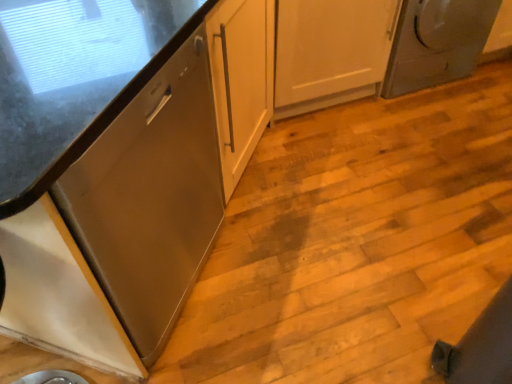
Describe the element at coordinates (74, 79) in the screenshot. The image size is (512, 384). I see `satin wood cabinet at left, positioned as the 2th cabinetry in bottom-to-top order` at that location.

What do you see at coordinates (437, 43) in the screenshot? Image resolution: width=512 pixels, height=384 pixels. I see `satin silver dryer at upper right` at bounding box center [437, 43].

What do you see at coordinates (59, 295) in the screenshot? I see `white glossy cabinet at lower left, the first cabinetry in the bottom-to-top sequence` at bounding box center [59, 295].

What are the coordinates of `white glossy cabinet at lower left, arranged as the second cabinetry when viewed from the top` in the screenshot? It's located at (59, 295).

The height and width of the screenshot is (384, 512). In order to click on satin wood cabinet at left, the 1th cabinetry positioned from the top in this screenshot , I will do `click(74, 79)`.

From the image's perspective, would you say satin silver dryer at upper right is shown under white glossy cabinet at lower left, the first cabinetry in the bottom-to-top sequence?

No, from the image's perspective, satin silver dryer at upper right is not beneath white glossy cabinet at lower left, the first cabinetry in the bottom-to-top sequence.

Is satin silver dryer at upper right aimed at white glossy cabinet at lower left, arranged as the second cabinetry when viewed from the top?

No, satin silver dryer at upper right is not facing towards white glossy cabinet at lower left, arranged as the second cabinetry when viewed from the top.

Is satin silver dryer at upper right smaller than white glossy cabinet at lower left, arranged as the second cabinetry when viewed from the top?

Actually, satin silver dryer at upper right might be larger than white glossy cabinet at lower left, arranged as the second cabinetry when viewed from the top.

From a real-world perspective, is satin wood cabinet at left, the 1th cabinetry positioned from the top, positioned above or below satin silver dryer at upper right?

satin wood cabinet at left, the 1th cabinetry positioned from the top, is above satin silver dryer at upper right.

Can you confirm if satin wood cabinet at left, positioned as the 2th cabinetry in bottom-to-top order, is positioned to the right of satin silver dryer at upper right?

No, satin wood cabinet at left, positioned as the 2th cabinetry in bottom-to-top order, is not to the right of satin silver dryer at upper right.

From the image's perspective, is satin wood cabinet at left, the 1th cabinetry positioned from the top, positioned above or below satin silver dryer at upper right?

satin wood cabinet at left, the 1th cabinetry positioned from the top, is situated lower than satin silver dryer at upper right in the image.

In order to click on home appliance above the satin wood cabinet at left, positioned as the 2th cabinetry in bottom-to-top order (from the image's perspective) in this screenshot , I will do `click(437, 43)`.

Image resolution: width=512 pixels, height=384 pixels. What are the coordinates of `home appliance on the right of satin wood cabinet at left, the 1th cabinetry positioned from the top` in the screenshot? It's located at (437, 43).

Is satin silver dryer at upper right outside of satin wood cabinet at left, the 1th cabinetry positioned from the top?

Yes, satin silver dryer at upper right is outside of satin wood cabinet at left, the 1th cabinetry positioned from the top.

Based on the photo, is satin silver dryer at upper right turned away from satin wood cabinet at left, positioned as the 2th cabinetry in bottom-to-top order?

satin silver dryer at upper right does not have its back to satin wood cabinet at left, positioned as the 2th cabinetry in bottom-to-top order.

Based on the photo, is satin silver dryer at upper right positioned behind satin wood cabinet at left, positioned as the 2th cabinetry in bottom-to-top order?

That is True.

In the scene shown: From a real-world perspective, is satin wood cabinet at left, positioned as the 2th cabinetry in bottom-to-top order, positioned under white glossy cabinet at lower left, arranged as the second cabinetry when viewed from the top, based on gravity?

Incorrect, from a real-world perspective, satin wood cabinet at left, positioned as the 2th cabinetry in bottom-to-top order, is higher than white glossy cabinet at lower left, arranged as the second cabinetry when viewed from the top.

This screenshot has height=384, width=512. Identify the location of cabinetry that is under the satin wood cabinet at left, positioned as the 2th cabinetry in bottom-to-top order (from a real-world perspective). (59, 295).

Would you say satin wood cabinet at left, positioned as the 2th cabinetry in bottom-to-top order, is inside or outside white glossy cabinet at lower left, the first cabinetry in the bottom-to-top sequence?

satin wood cabinet at left, positioned as the 2th cabinetry in bottom-to-top order, is spatially situated outside white glossy cabinet at lower left, the first cabinetry in the bottom-to-top sequence.

From the image's perspective, is satin wood cabinet at left, the 1th cabinetry positioned from the top, positioned above or below white glossy cabinet at lower left, the first cabinetry in the bottom-to-top sequence?

satin wood cabinet at left, the 1th cabinetry positioned from the top, is above white glossy cabinet at lower left, the first cabinetry in the bottom-to-top sequence.

Where is `the 2nd cabinetry in front of the satin silver dryer at upper right, counting from the anchor's position`? The width and height of the screenshot is (512, 384). the 2nd cabinetry in front of the satin silver dryer at upper right, counting from the anchor's position is located at coordinates (59, 295).

Which object is thinner, white glossy cabinet at lower left, the first cabinetry in the bottom-to-top sequence, or satin silver dryer at upper right?

white glossy cabinet at lower left, the first cabinetry in the bottom-to-top sequence.

From the image's perspective, which is below, white glossy cabinet at lower left, arranged as the second cabinetry when viewed from the top, or satin silver dryer at upper right?

white glossy cabinet at lower left, arranged as the second cabinetry when viewed from the top, appears lower in the image.

Between point (91, 277) and point (81, 35), which one is positioned behind?

The point (81, 35) is farther from the camera.

How different are the orientations of white glossy cabinet at lower left, the first cabinetry in the bottom-to-top sequence, and satin wood cabinet at left, positioned as the 2th cabinetry in bottom-to-top order, in degrees?

The angular difference between white glossy cabinet at lower left, the first cabinetry in the bottom-to-top sequence, and satin wood cabinet at left, positioned as the 2th cabinetry in bottom-to-top order, is 88.7 degrees.

Can you confirm if white glossy cabinet at lower left, the first cabinetry in the bottom-to-top sequence, is smaller than satin wood cabinet at left, the 1th cabinetry positioned from the top?

Yes, white glossy cabinet at lower left, the first cabinetry in the bottom-to-top sequence, is smaller than satin wood cabinet at left, the 1th cabinetry positioned from the top.

From the picture: Does white glossy cabinet at lower left, arranged as the second cabinetry when viewed from the top, have a greater width compared to satin wood cabinet at left, the 1th cabinetry positioned from the top?

In fact, white glossy cabinet at lower left, arranged as the second cabinetry when viewed from the top, might be narrower than satin wood cabinet at left, the 1th cabinetry positioned from the top.

I want to click on home appliance lying behind the white glossy cabinet at lower left, the first cabinetry in the bottom-to-top sequence, so click(437, 43).

The width and height of the screenshot is (512, 384). In the image, there is a satin wood cabinet at left, positioned as the 2th cabinetry in bottom-to-top order. Identify the location of home appliance above it (from the image's perspective). (437, 43).

From the image, which object appears to be nearer to white glossy cabinet at lower left, the first cabinetry in the bottom-to-top sequence, satin silver dryer at upper right or satin wood cabinet at left, the 1th cabinetry positioned from the top?

Based on the image, satin wood cabinet at left, the 1th cabinetry positioned from the top, appears to be nearer to white glossy cabinet at lower left, the first cabinetry in the bottom-to-top sequence.

Estimate the real-world distances between objects in this image. Which object is closer to satin wood cabinet at left, positioned as the 2th cabinetry in bottom-to-top order, satin silver dryer at upper right or white glossy cabinet at lower left, arranged as the second cabinetry when viewed from the top?

Based on the image, white glossy cabinet at lower left, arranged as the second cabinetry when viewed from the top, appears to be nearer to satin wood cabinet at left, positioned as the 2th cabinetry in bottom-to-top order.

Looking at the image, which one is located further to white glossy cabinet at lower left, the first cabinetry in the bottom-to-top sequence, satin wood cabinet at left, the 1th cabinetry positioned from the top, or satin silver dryer at upper right?

satin silver dryer at upper right is positioned further to the anchor white glossy cabinet at lower left, the first cabinetry in the bottom-to-top sequence.

Considering their positions, is white glossy cabinet at lower left, arranged as the second cabinetry when viewed from the top, positioned closer to satin wood cabinet at left, positioned as the 2th cabinetry in bottom-to-top order, than satin silver dryer at upper right?

The object closer to satin wood cabinet at left, positioned as the 2th cabinetry in bottom-to-top order, is white glossy cabinet at lower left, arranged as the second cabinetry when viewed from the top.

Looking at the image, which one is located closer to satin silver dryer at upper right, white glossy cabinet at lower left, the first cabinetry in the bottom-to-top sequence, or satin wood cabinet at left, positioned as the 2th cabinetry in bottom-to-top order?

satin wood cabinet at left, positioned as the 2th cabinetry in bottom-to-top order, is positioned closer to the anchor satin silver dryer at upper right.

Estimate the real-world distances between objects in this image. Which object is closer to satin silver dryer at upper right, satin wood cabinet at left, positioned as the 2th cabinetry in bottom-to-top order, or white glossy cabinet at lower left, the first cabinetry in the bottom-to-top sequence?

satin wood cabinet at left, positioned as the 2th cabinetry in bottom-to-top order, is positioned closer to the anchor satin silver dryer at upper right.

Find the location of `cabinetry between white glossy cabinet at lower left, the first cabinetry in the bottom-to-top sequence, and satin silver dryer at upper right`. cabinetry between white glossy cabinet at lower left, the first cabinetry in the bottom-to-top sequence, and satin silver dryer at upper right is located at coordinates (74, 79).